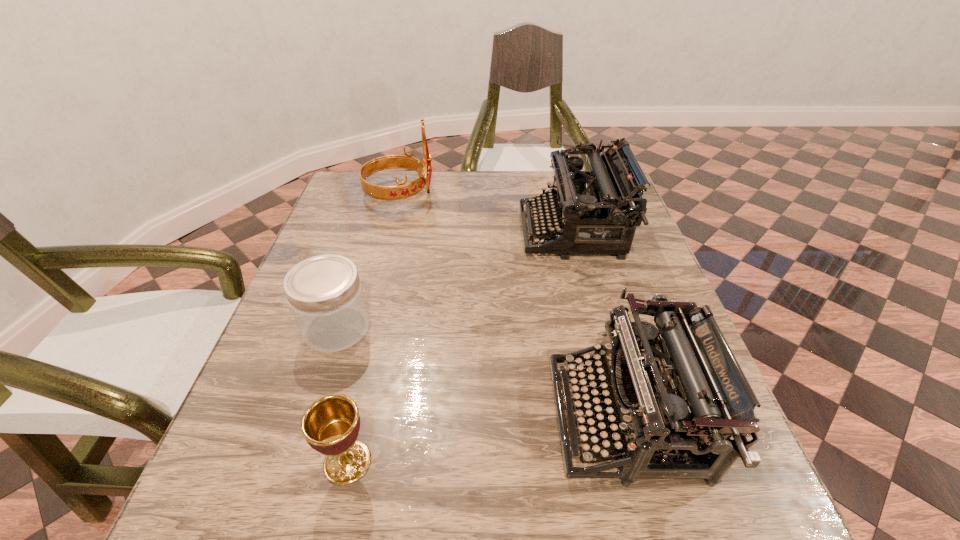
Identify the location of free space located 0.400m on the typing side of the third shortest object. The height and width of the screenshot is (540, 960). (318, 417).

Find the location of a particular element. This screenshot has height=540, width=960. vacant region located on the typing side of the third shortest object is located at coordinates (371, 417).

The height and width of the screenshot is (540, 960). What are the coordinates of `free space located 0.300m on the typing side of the third shortest object` in the screenshot? It's located at (376, 417).

You are a GUI agent. You are given a task and a screenshot of the screen. Output one action in this format:
    pyautogui.click(x=<x>, y=<y>)
    Task: Click on the vacant point located on the right of the jar
    The image size is (960, 540).
    Given the screenshot: What is the action you would take?
    pyautogui.click(x=523, y=328)

Where is `free region located 0.280m on the right of the chalice`? Image resolution: width=960 pixels, height=540 pixels. free region located 0.280m on the right of the chalice is located at coordinates (553, 462).

This screenshot has height=540, width=960. I want to click on tiara located at the far edge, so click(x=404, y=190).

The width and height of the screenshot is (960, 540). What are the coordinates of `typewriter positioned at the far edge` in the screenshot? It's located at (592, 210).

Find the location of `typewriter present at the near edge`. typewriter present at the near edge is located at coordinates [x=685, y=395].

Where is `chalice that is at the near edge`? The height and width of the screenshot is (540, 960). chalice that is at the near edge is located at coordinates (330, 425).

Find the location of a particular element. The image size is (960, 540). tiara located at the left edge is located at coordinates coord(404,190).